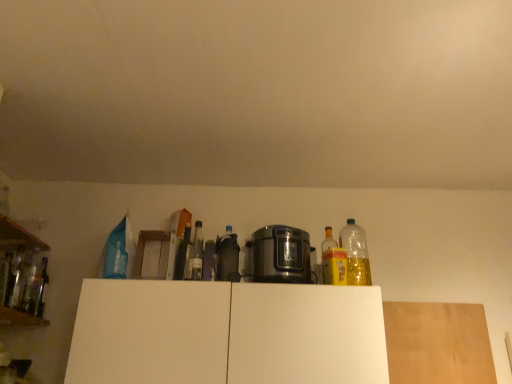
Question: Considering their positions, is translucent plastic bottle at center, the third bottle when ordered from right to left, located in front of or behind satin metallic rice cooker at center?

Choices:
 (A) front
 (B) behind

Answer: (B)

Question: In terms of size, does translucent plastic bottle at center, the third bottle when ordered from right to left, appear bigger or smaller than satin metallic rice cooker at center?

Choices:
 (A) big
 (B) small

Answer: (B)

Question: Which object is the farthest from the white matte cabinet at center?

Choices:
 (A) clear glass bottle at center, acting as the fifth bottle starting from the left
 (B) clear glass bottle at left, the second bottle from the left
 (C) wooden at left, the 2th shelf positioned from the top
 (D) satin metallic rice cooker at center
 (E) translucent plastic bottle at center, marked as the sixth bottle in a left-to-right arrangement

Answer: (C)

Question: Based on their relative distances, which object is nearer to the white matte cabinet at center?

Choices:
 (A) green glass bottle at center, which ranks as the fifth bottle in right-to-left order
 (B) light brown wood at upper center
 (C) yellow translucent bottle at center, the seventh bottle from the left
 (D) wooden at left, placed as the 1th shelf when sorted from top to bottom
 (E) satin metallic rice cooker at center

Answer: (E)